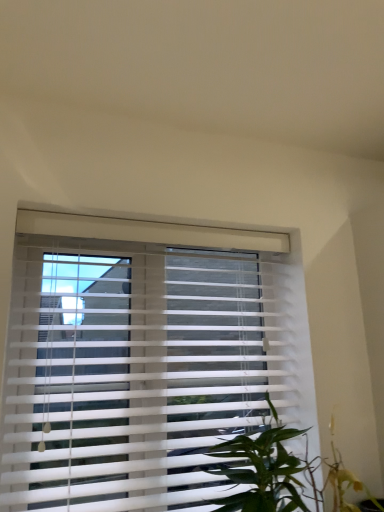
Question: From a real-world perspective, is green leafy plant at lower right physically located above or below white plastic blinds at center?

Choices:
 (A) above
 (B) below

Answer: (B)

Question: Is green leafy plant at lower right in front of or behind white plastic blinds at center in the image?

Choices:
 (A) front
 (B) behind

Answer: (A)

Question: Looking at their shapes, would you say green leafy plant at lower right is wider or thinner than white plastic blinds at center?

Choices:
 (A) wide
 (B) thin

Answer: (A)

Question: Considering the positions of white plastic blinds at center and green leafy plant at lower right in the image, is white plastic blinds at center bigger or smaller than green leafy plant at lower right?

Choices:
 (A) small
 (B) big

Answer: (B)

Question: Does point (236, 240) appear closer or farther from the camera than point (264, 482)?

Choices:
 (A) closer
 (B) farther

Answer: (B)

Question: Based on their positions, is white plastic blinds at center located to the left or right of green leafy plant at lower right?

Choices:
 (A) right
 (B) left

Answer: (B)

Question: In the image, is white plastic blinds at center positioned in front of or behind green leafy plant at lower right?

Choices:
 (A) behind
 (B) front

Answer: (A)